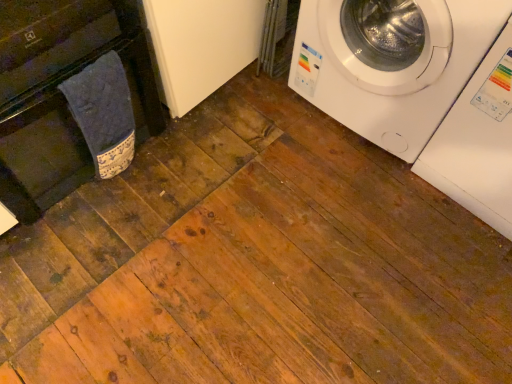
Question: Considering the relative positions of white glossy washing machine at upper right, acting as the 1th washing machine starting from the left, and white glossy washing machine at upper right, the 2th washing machine viewed from the left, in the image provided, is white glossy washing machine at upper right, acting as the 1th washing machine starting from the left, to the right of white glossy washing machine at upper right, the 2th washing machine viewed from the left, from the viewer's perspective?

Choices:
 (A) no
 (B) yes

Answer: (A)

Question: Could you tell me if white glossy washing machine at upper right, acting as the 1th washing machine starting from the left, is facing white glossy washing machine at upper right, the 2th washing machine viewed from the left?

Choices:
 (A) no
 (B) yes

Answer: (A)

Question: Is the surface of white glossy washing machine at upper right, acting as the 1th washing machine starting from the left, in direct contact with white glossy washing machine at upper right, the 1th washing machine viewed from the right?

Choices:
 (A) yes
 (B) no

Answer: (B)

Question: Considering the relative positions of white glossy washing machine at upper right, which is the 2th washing machine in right-to-left order, and white glossy washing machine at upper right, the 1th washing machine viewed from the right, in the image provided, is white glossy washing machine at upper right, which is the 2th washing machine in right-to-left order, in front of white glossy washing machine at upper right, the 1th washing machine viewed from the right,?

Choices:
 (A) yes
 (B) no

Answer: (B)

Question: Is there a large distance between white glossy washing machine at upper right, which is the 2th washing machine in right-to-left order, and white glossy washing machine at upper right, the 2th washing machine viewed from the left?

Choices:
 (A) yes
 (B) no

Answer: (B)

Question: From the image's perspective, is white glossy washing machine at upper right, which is the 2th washing machine in right-to-left order, under white glossy washing machine at upper right, the 1th washing machine viewed from the right?

Choices:
 (A) no
 (B) yes

Answer: (A)

Question: Is white glossy washing machine at upper right, the 2th washing machine viewed from the left, at the left side of blue fabric towel at left?

Choices:
 (A) no
 (B) yes

Answer: (A)

Question: Is white glossy washing machine at upper right, the 1th washing machine viewed from the right, shorter than blue fabric towel at left?

Choices:
 (A) no
 (B) yes

Answer: (A)

Question: Is white glossy washing machine at upper right, the 2th washing machine viewed from the left, behind blue fabric towel at left?

Choices:
 (A) yes
 (B) no

Answer: (B)

Question: From the image's perspective, is white glossy washing machine at upper right, the 1th washing machine viewed from the right, located beneath blue fabric towel at left?

Choices:
 (A) yes
 (B) no

Answer: (B)

Question: Can you confirm if white glossy washing machine at upper right, the 2th washing machine viewed from the left, is smaller than blue fabric towel at left?

Choices:
 (A) yes
 (B) no

Answer: (B)

Question: From a real-world perspective, does white glossy washing machine at upper right, the 2th washing machine viewed from the left, stand above blue fabric towel at left?

Choices:
 (A) no
 (B) yes

Answer: (B)

Question: Is white glossy washing machine at upper right, the 2th washing machine viewed from the left, not inside black matte dishwasher at left?

Choices:
 (A) no
 (B) yes

Answer: (B)